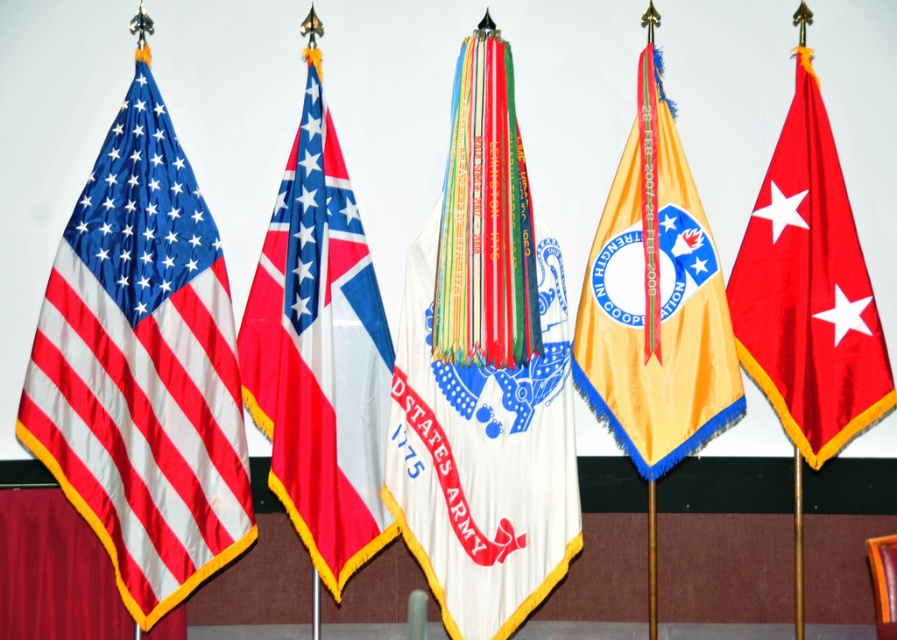
You are a curator arranging flags in a gallery. You need to ensure that the distance between the matte fabric flag at left and the white fabric flag at center is at least 50 centimeters for proper spacing. Based on the image, is the current spacing sufficient?

The distance between the matte fabric flag at left and the white fabric flag at center is 51.63 centimeters, which is more than the required 50 centimeters. Therefore, the current spacing is sufficient.

You are standing in front of five flags displayed side by side on a plain white background. You see the American flag on the far left and the white fabric flag at center. Which flag is closer to the center of the image?

The white fabric flag at center is closer to the center of the image because its position is at point (484,376), which is near the center coordinates.